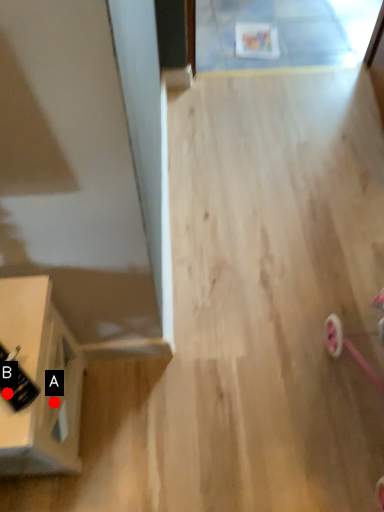
Question: Two points are circled on the image, labeled by A and B beside each circle. Which point appears farthest from the camera in this image?

Choices:
 (A) A is further
 (B) B is further

Answer: (A)